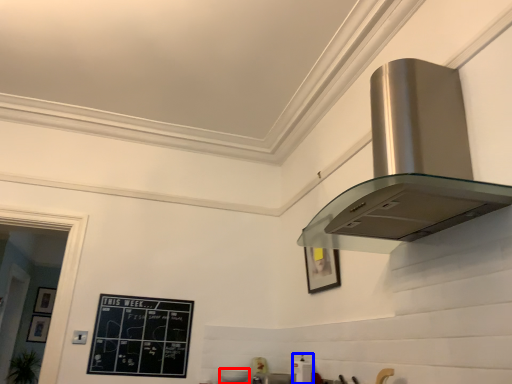
Question: Which object appears closest to the camera in this image, appliance (highlighted by a red box) or appliance (highlighted by a blue box)?

Choices:
 (A) appliance
 (B) appliance

Answer: (B)